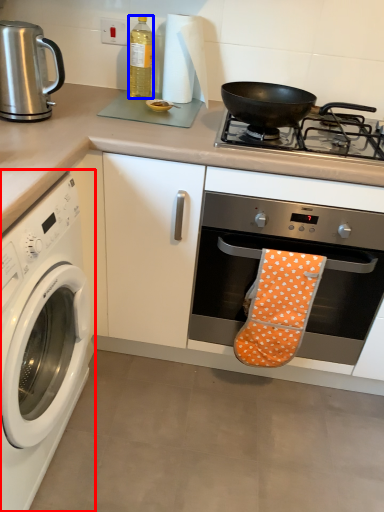
Question: Which point is closer to the camera, washing machine (highlighted by a red box) or bottle (highlighted by a blue box)?

Choices:
 (A) washing machine
 (B) bottle

Answer: (A)